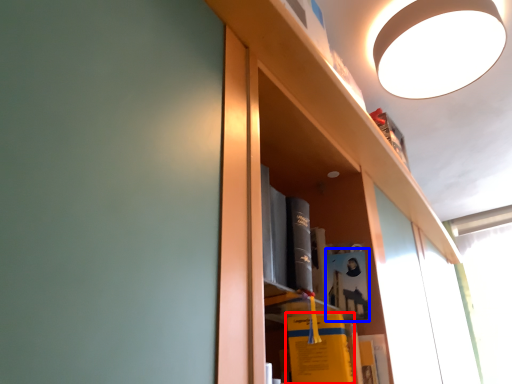
Question: Which of the following is the closest to the observer, book (highlighted by a red box) or book (highlighted by a blue box)?

Choices:
 (A) book
 (B) book

Answer: (A)